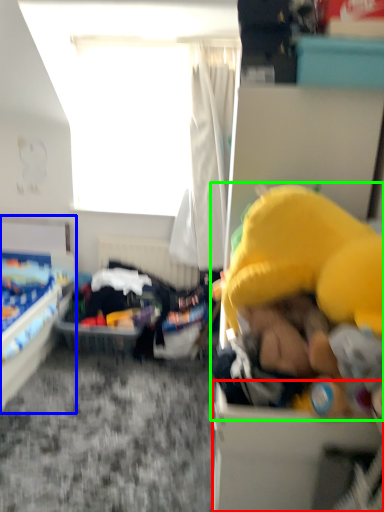
Question: Which object is positioned closest to box (highlighted by a red box)? Select from bed (highlighted by a blue box) and toy (highlighted by a green box).

Choices:
 (A) bed
 (B) toy

Answer: (B)